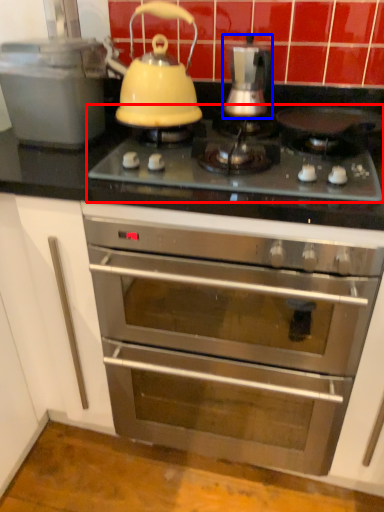
Question: Which object is further to the camera taking this photo, gas stove (highlighted by a red box) or kitchen appliance (highlighted by a blue box)?

Choices:
 (A) gas stove
 (B) kitchen appliance

Answer: (B)